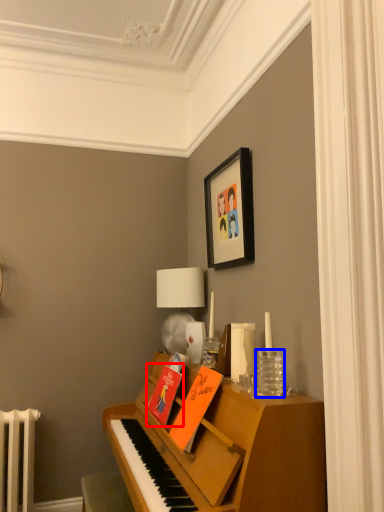
Question: Which object appears closest to the camera in this image, book (highlighted by a red box) or glass vase (highlighted by a blue box)?

Choices:
 (A) book
 (B) glass vase

Answer: (B)